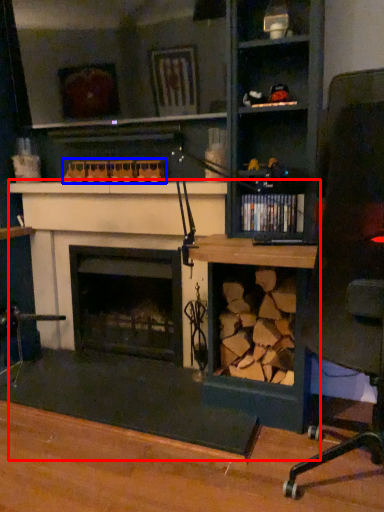
Question: Which object appears farthest to the camera in this image, computer desk (highlighted by a red box) or toy (highlighted by a blue box)?

Choices:
 (A) computer desk
 (B) toy

Answer: (B)